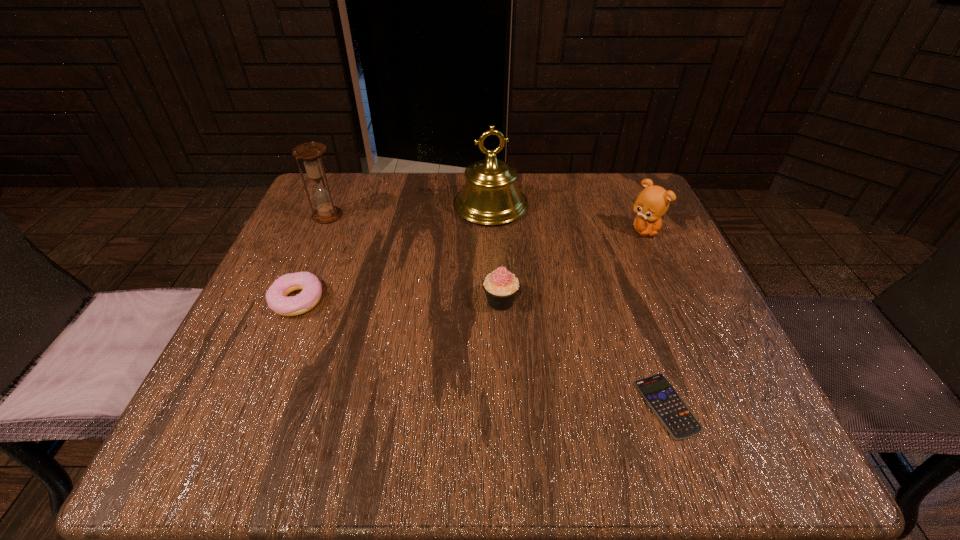
In the image, there is a desktop. Where is `blank space at the far right corner`? The width and height of the screenshot is (960, 540). blank space at the far right corner is located at coordinates (597, 173).

At what (x,y) coordinates should I click in order to perform the action: click on vacant space at the near right corner of the desktop. Please return your answer as a coordinate pair (x, y). Looking at the image, I should click on (720, 463).

Locate an element on the screen. Image resolution: width=960 pixels, height=540 pixels. free area in between the bell and the hourglass is located at coordinates (409, 211).

At what (x,y) coordinates should I click in order to perform the action: click on vacant area between the second tallest object and the fifth object from left to right. Please return your answer as a coordinate pair (x, y). The width and height of the screenshot is (960, 540). Looking at the image, I should click on (497, 311).

Where is `free space between the shortest object and the cupcake`? The image size is (960, 540). free space between the shortest object and the cupcake is located at coordinates (584, 354).

This screenshot has width=960, height=540. In order to click on unoccupied area between the bell and the fifth tallest object in this screenshot , I will do `click(394, 253)`.

Identify the location of free point between the cupcake and the hourglass. The height and width of the screenshot is (540, 960). coord(414,259).

The image size is (960, 540). In order to click on free space between the calculator and the hourglass in this screenshot , I will do `click(497, 311)`.

Locate an element on the screen. The height and width of the screenshot is (540, 960). free space between the second tallest object and the nearest object is located at coordinates (497, 311).

Locate an element on the screen. This screenshot has width=960, height=540. the fifth closest object to the fourth tallest object is located at coordinates (310, 153).